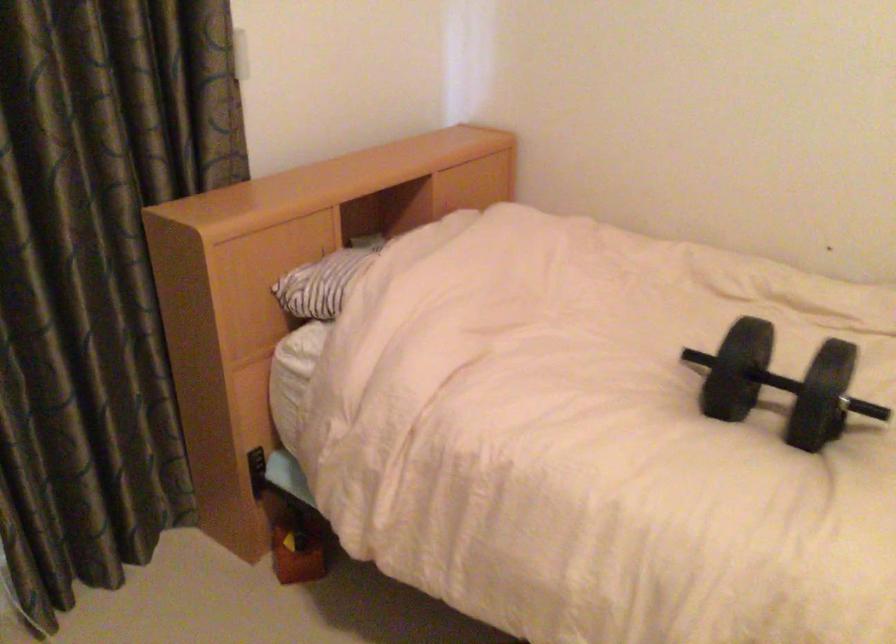
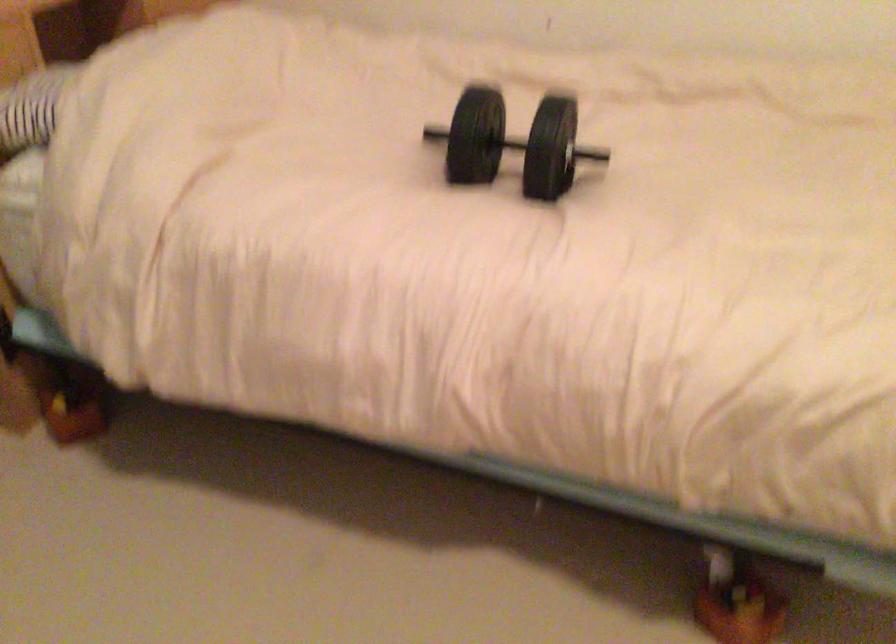
Question: In a continuous first-person perspective shot, in which direction is the camera moving?

Choices:
 (A) Left
 (B) Right
 (C) Forward
 (D) Backward

Answer: (B)